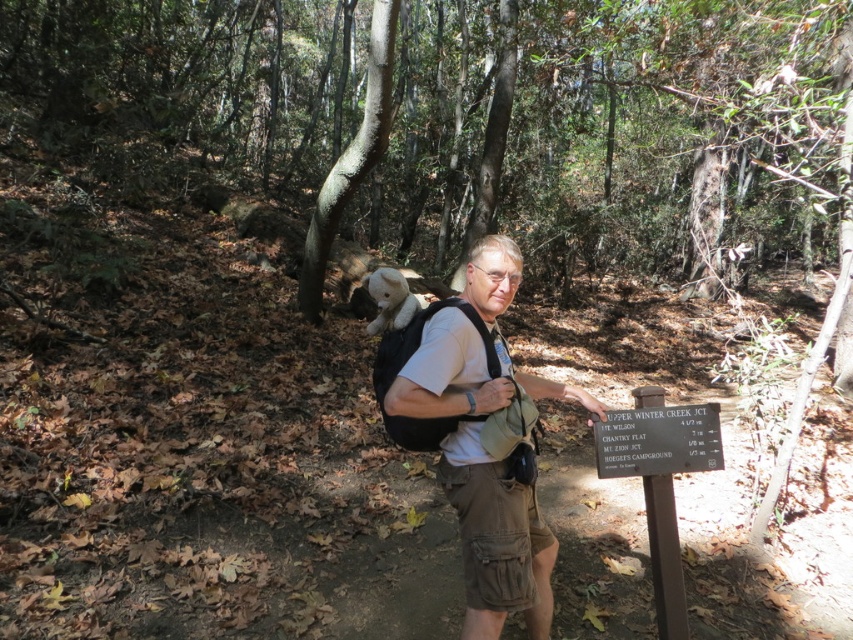
You are standing at the wooden signpost in the forest. You want to place a small 1.5 feet wide flowerpot between you and the point at coordinate point (479, 273). Will the flowerpot fit in that space?

The distance between you and the point at coordinate point (479, 273) is 7.70 feet, so the flowerpot of 1.5 feet width will fit comfortably in that space.

You are planning to carry both the matte black backpack at center and the black plastic sign at center. Which one requires more space to carry?

The matte black backpack at center requires more space to carry because its width is larger than the black plastic sign at center.

You are navigating a hiking trail and see two points marked on your map. The first point is labeled as point [489,312] and the second as point [616,472]. According to the scene, which point is closer to your current position?

Point [489,312] is in front of point [616,472], so it is closer to your current position.